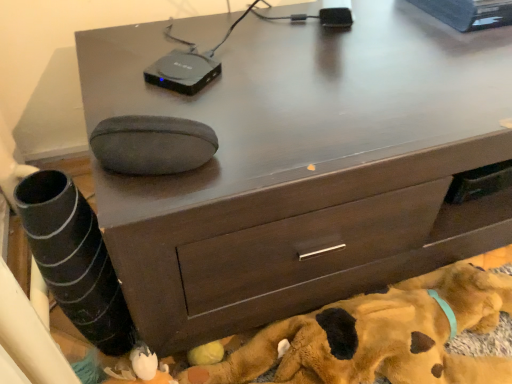
Find the location of a particular element. Image resolution: width=512 pixels, height=384 pixels. vacant area that is situated to the right of black plastic device at upper center is located at coordinates (297, 91).